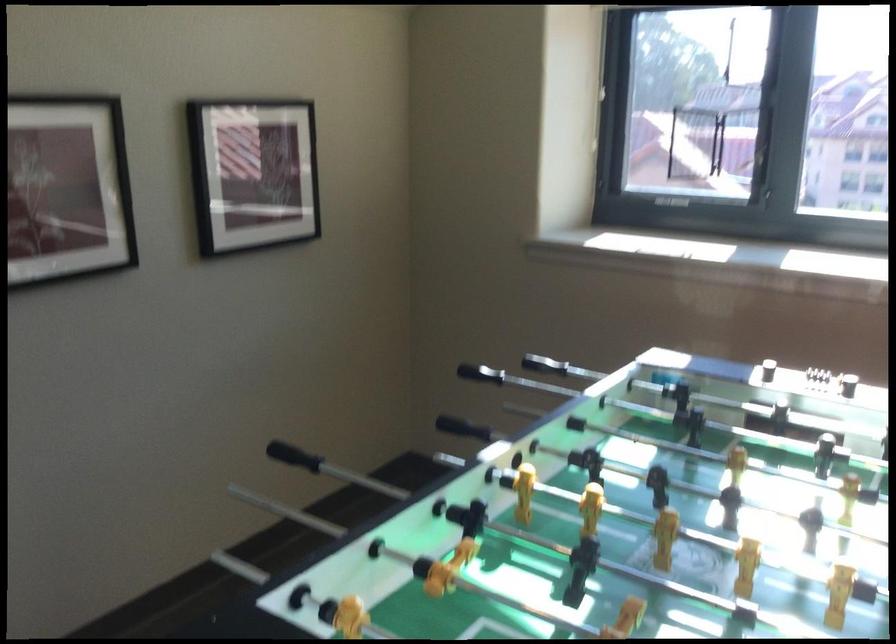
Locate an element on the screen. This screenshot has width=896, height=644. black window latch is located at coordinates (672, 201).